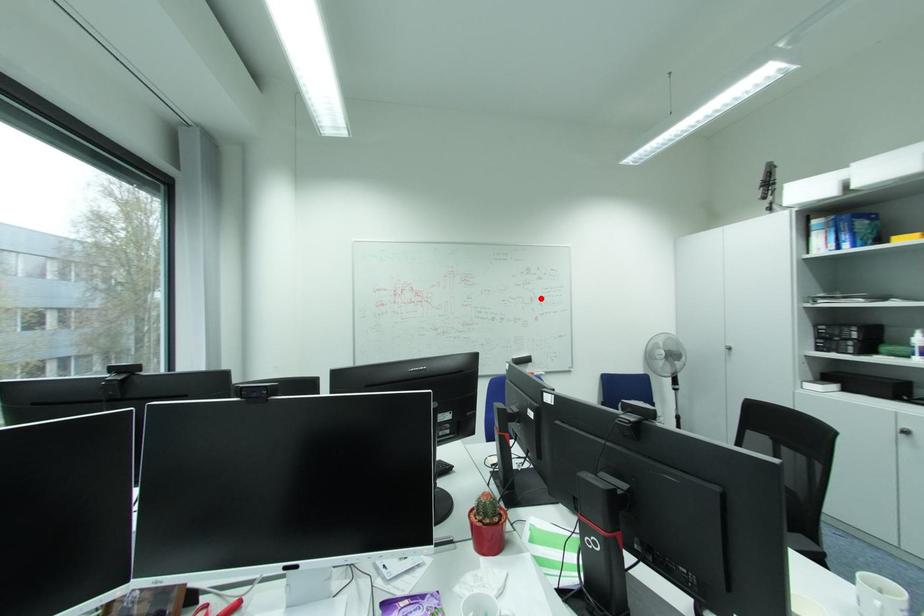
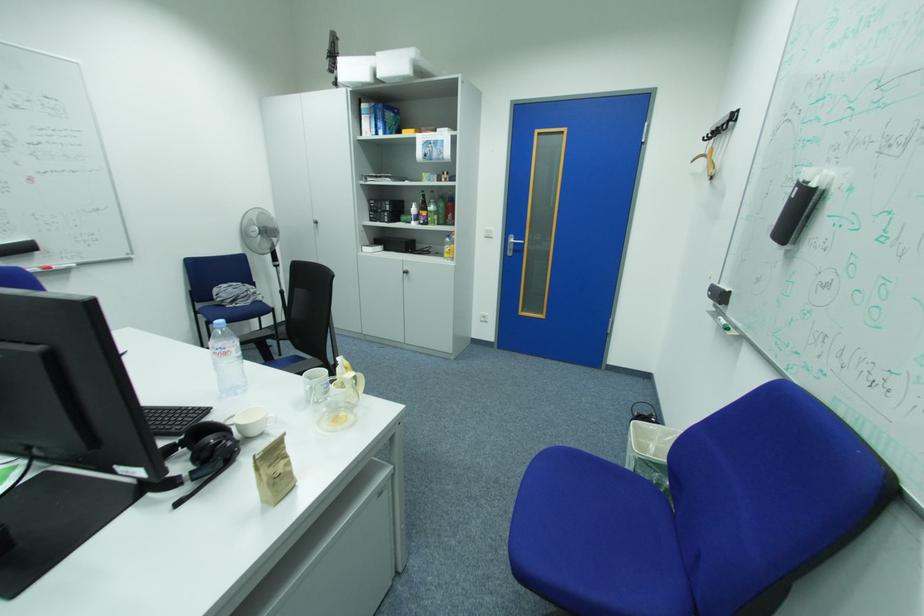
In the second image, find the point that corresponds to the highlighted location in the first image.

(14, 140)